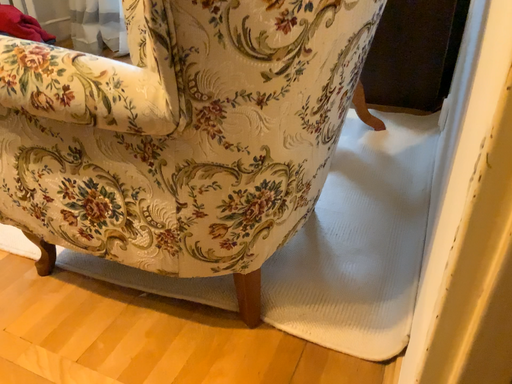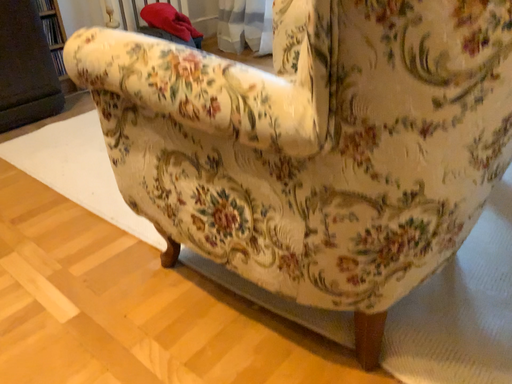
Question: Which way did the camera rotate in the video?

Choices:
 (A) rotated right
 (B) rotated left

Answer: (B)